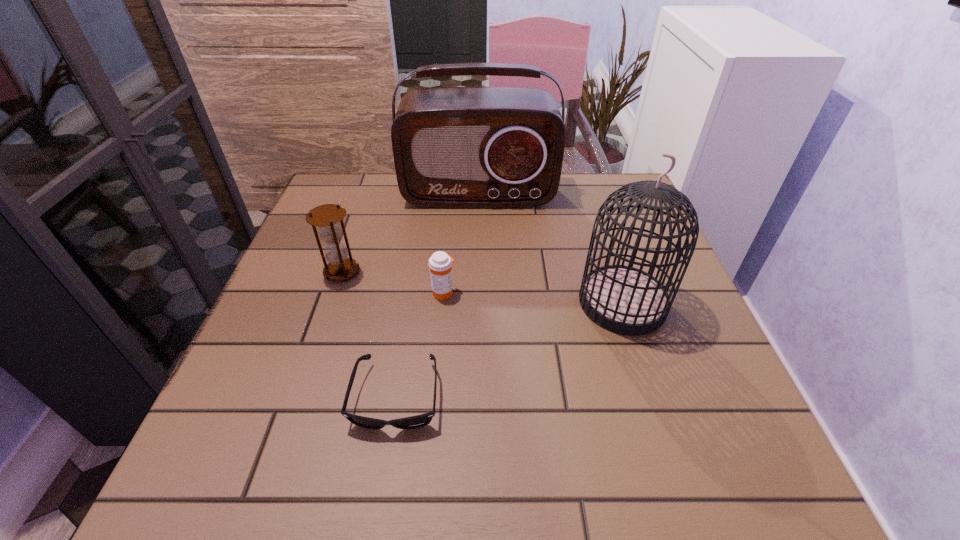
The width and height of the screenshot is (960, 540). In order to click on the farthest object in this screenshot , I will do `click(454, 147)`.

Locate an element on the screen. The image size is (960, 540). birdcage is located at coordinates (625, 300).

At what (x,y) coordinates should I click in order to perform the action: click on the leftmost object. Please return your answer as a coordinate pair (x, y). The image size is (960, 540). Looking at the image, I should click on (326, 217).

Find the location of a particular element. hourglass is located at coordinates (326, 217).

I want to click on the second shortest object, so click(440, 263).

This screenshot has width=960, height=540. I want to click on sunglasses, so click(413, 422).

Locate an element on the screen. The width and height of the screenshot is (960, 540). the nearest object is located at coordinates pyautogui.click(x=413, y=422).

Identify the location of vacant space located 0.400m on the front panel of the radio receiver. (478, 330).

In order to click on vacant region located on the back of the birdcage in this screenshot , I will do `click(597, 224)`.

At what (x,y) coordinates should I click in order to perform the action: click on vacant space located on the right of the leftmost object. Please return your answer as a coordinate pair (x, y). The image size is (960, 540). Looking at the image, I should click on (467, 272).